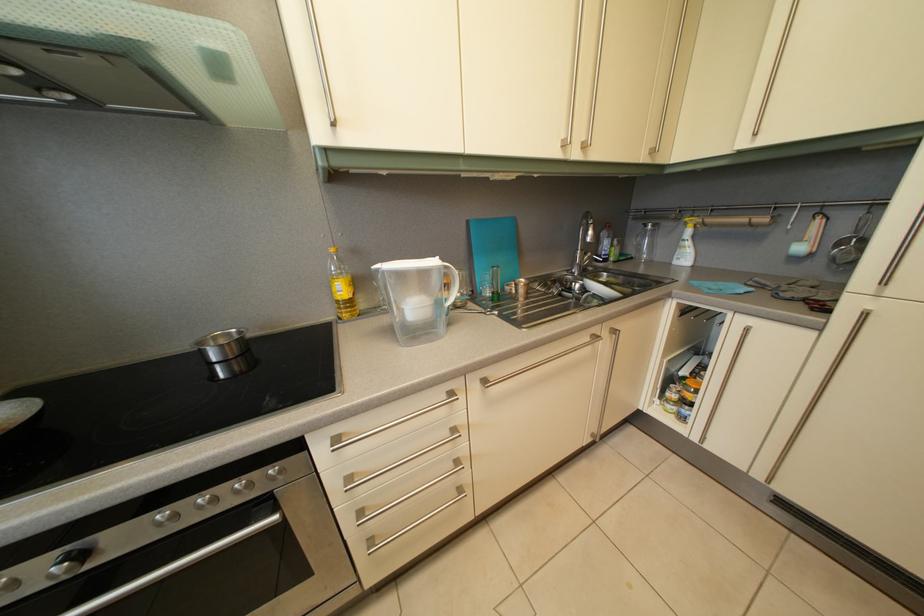
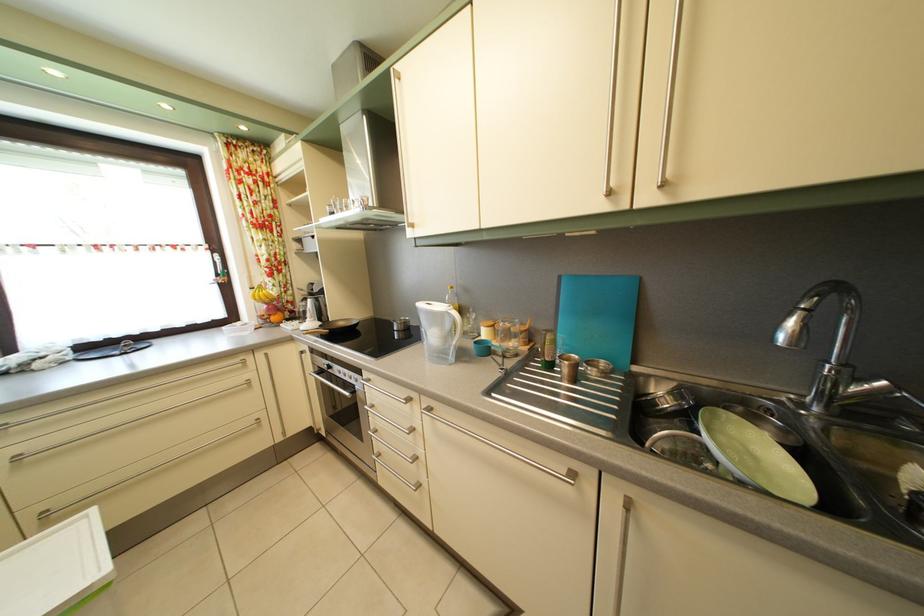
Locate, in the second image, the point that corresponds to pixel 258 342 in the first image.

(420, 331)